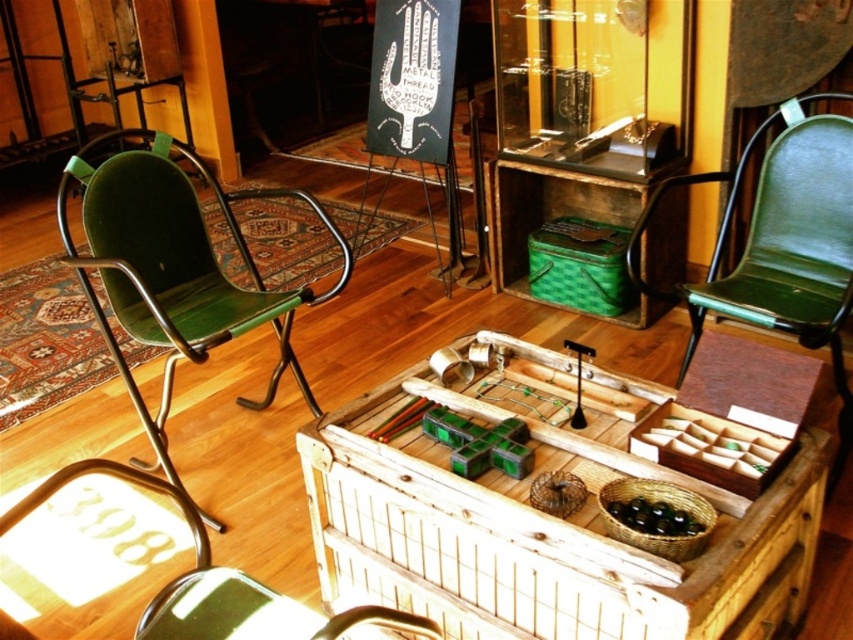
Question: From the image, what is the correct spatial relationship of wooden chest at center in relation to green leather armchair at right?

Choices:
 (A) left
 (B) right

Answer: (A)

Question: Can you confirm if green leather armchair at left is thinner than green leather armchair at right?

Choices:
 (A) no
 (B) yes

Answer: (A)

Question: Which point is closer to the camera taking this photo?

Choices:
 (A) (844, 179)
 (B) (256, 195)
 (C) (809, 449)

Answer: (C)

Question: Among these objects, which one is farthest from the camera?

Choices:
 (A) wooden chest at center
 (B) green leather armchair at left
 (C) green leather armchair at right

Answer: (C)

Question: Is green leather armchair at left bigger than green leather armchair at right?

Choices:
 (A) no
 (B) yes

Answer: (B)

Question: Which is farther from the green leather armchair at left?

Choices:
 (A) green leather armchair at right
 (B) wooden chest at center

Answer: (A)